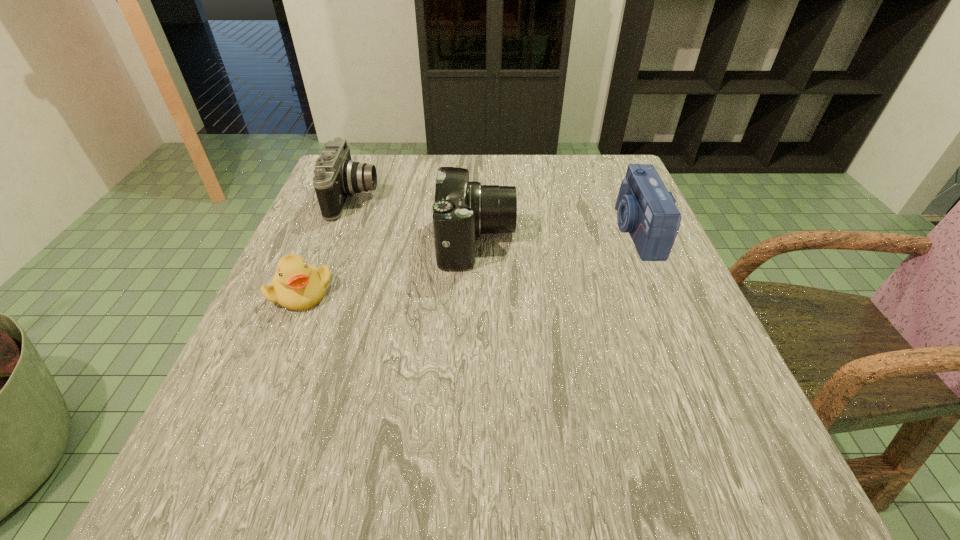
Find the location of a particular element. The width and height of the screenshot is (960, 540). free space between the leftmost camera and the third object from left to right is located at coordinates (416, 219).

Identify the location of free space between the rightmost object and the second camera from left to right. This screenshot has height=540, width=960. (557, 236).

Find the location of a particular element. This screenshot has width=960, height=540. unoccupied position between the third object from left to right and the rightmost camera is located at coordinates (557, 236).

Where is `vacant area that lies between the second camera from left to right and the leftmost camera`? This screenshot has width=960, height=540. vacant area that lies between the second camera from left to right and the leftmost camera is located at coordinates (416, 219).

Locate an element on the screen. The height and width of the screenshot is (540, 960). free area in between the second camera from left to right and the shortest object is located at coordinates (389, 267).

This screenshot has width=960, height=540. I want to click on empty space between the second camera from right to left and the rightmost camera, so [557, 236].

You are a GUI agent. You are given a task and a screenshot of the screen. Output one action in this format:
    pyautogui.click(x=<x>, y=<y>)
    Task: Click on the free space between the rightmost object and the second camera from left to right
    The height and width of the screenshot is (540, 960).
    Given the screenshot: What is the action you would take?
    pyautogui.click(x=557, y=236)

Locate an element on the screen. The width and height of the screenshot is (960, 540). object that can be found as the closest to the duckling is located at coordinates (336, 177).

You are a GUI agent. You are given a task and a screenshot of the screen. Output one action in this format:
    pyautogui.click(x=<x>, y=<y>)
    Task: Click on the object that is the third closest to the leftmost camera
    The image size is (960, 540).
    Given the screenshot: What is the action you would take?
    pyautogui.click(x=646, y=210)

Choose which camera is the nearest neighbor to the leftmost camera. Please provide its 2D coordinates. Your answer should be formatted as a tuple, i.e. [(x, y)], where the tuple contains the x and y coordinates of a point satisfying the conditions above.

[(462, 210)]